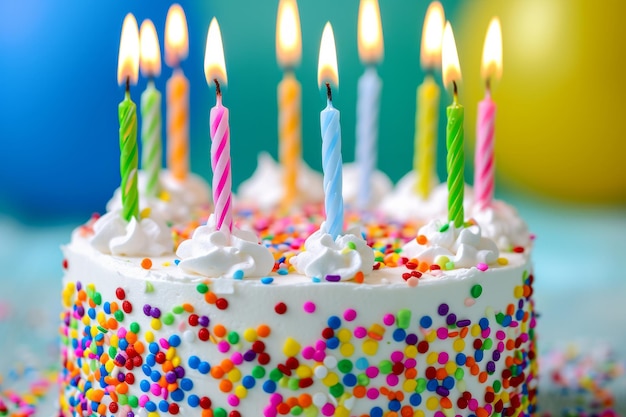
Locate an element on the screen. The width and height of the screenshot is (626, 417). candle flames is located at coordinates (322, 67), (290, 34), (215, 49), (173, 24), (151, 44), (123, 52), (357, 25), (431, 36), (451, 56), (495, 42).